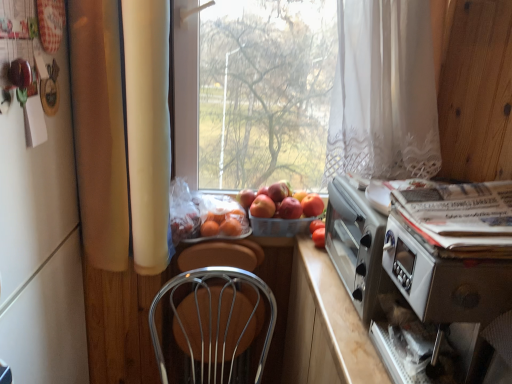
Describe the element at coordinates (262, 207) in the screenshot. Image resolution: width=512 pixels, height=384 pixels. I see `red matte apple at center, positioned as the 1th apple in left-to-right order` at that location.

What do you see at coordinates (278, 191) in the screenshot?
I see `red matte apple at center, the 3th apple viewed from the right` at bounding box center [278, 191].

At what (x,y) coordinates should I click in order to perform the action: click on red matte tomato at lower right, the first fruit in the right-to-left sequence. Please return your answer as a coordinate pair (x, y). Looking at the image, I should click on (319, 237).

What do you see at coordinates (222, 224) in the screenshot?
I see `orange matte at center, placed as the 2th fruit when sorted from right to left` at bounding box center [222, 224].

Find the location of a particular element. This screenshot has height=384, width=512. red matte apple at center, the 4th apple in the right-to-left sequence is located at coordinates (262, 207).

From a real-world perspective, which apple is the 3rd one above the plastic basket at center? Please provide its 2D coordinates.

[(312, 205)]

Is red matte apple at center, the fourth apple in the left-to-right sequence, spatially inside plastic basket at center, or outside of it?

red matte apple at center, the fourth apple in the left-to-right sequence, is outside plastic basket at center.

Considering the relative sizes of red matte apple at center, the fourth apple in the left-to-right sequence, and plastic basket at center in the image provided, is red matte apple at center, the fourth apple in the left-to-right sequence, taller than plastic basket at center?

No, red matte apple at center, the fourth apple in the left-to-right sequence, is not taller than plastic basket at center.

From the picture: Between red matte apple at center, the fourth apple in the left-to-right sequence, and plastic basket at center, which one has smaller width?

red matte apple at center, the fourth apple in the left-to-right sequence.

Which of these two, red matte apple at center, the fourth apple in the left-to-right sequence, or green leafy tree at center, is bigger?

green leafy tree at center is bigger.

Can you confirm if red matte apple at center, acting as the first apple starting from the right, is shorter than green leafy tree at center?

Yes.

Is point (311, 195) farther from viewer compared to point (269, 95)?

Yes, it is.

Is red matte apple at center, the fourth apple in the left-to-right sequence, touching green leafy tree at center?

No, red matte apple at center, the fourth apple in the left-to-right sequence, is not touching green leafy tree at center.

From a real-world perspective, is metallic wire chair at center beneath white glossy fridge at left?

Yes, from a real-world perspective, metallic wire chair at center is beneath white glossy fridge at left.

From the image's perspective, is metallic wire chair at center on top of white glossy fridge at left?

Incorrect, from the image's perspective, metallic wire chair at center is lower than white glossy fridge at left.

Which is farther, (191, 305) or (84, 373)?

The point (84, 373) is more distant.

Where is `chair on the right side of white glossy fridge at left`? This screenshot has height=384, width=512. chair on the right side of white glossy fridge at left is located at coordinates (211, 327).

Is metallic silver toaster at right not close to white lace curtain at upper center?

No.

Does metallic silver toaster at right have a greater width compared to white lace curtain at upper center?

Yes, metallic silver toaster at right is wider than white lace curtain at upper center.

Can you confirm if metallic silver toaster at right is taller than white lace curtain at upper center?

No.

Is white lace curtain at upper center bigger than red matte apple at center, the second apple when ordered from right to left?

Yes, white lace curtain at upper center is bigger than red matte apple at center, the second apple when ordered from right to left.

Is white lace curtain at upper center not within red matte apple at center, the second apple when ordered from right to left?

Indeed, white lace curtain at upper center is completely outside red matte apple at center, the second apple when ordered from right to left.

Can you tell me how much white lace curtain at upper center and red matte apple at center, the second apple when ordered from right to left, differ in facing direction?

The angular difference between white lace curtain at upper center and red matte apple at center, the second apple when ordered from right to left, is 9.63 degrees.

Is point (433, 131) closer to camera compared to point (297, 201)?

That is True.

What's the angular difference between green leafy tree at center and red matte apple at center, the 3th apple viewed from the right,'s facing directions?

They differ by 9.93 degrees in their facing directions.

Does green leafy tree at center turn towards red matte apple at center, the 2th apple viewed from the left?

Yes, green leafy tree at center is oriented towards red matte apple at center, the 2th apple viewed from the left.

Who is taller, green leafy tree at center or red matte apple at center, the 2th apple viewed from the left?

With more height is green leafy tree at center.

Are green leafy tree at center and red matte apple at center, the 2th apple viewed from the left, far apart?

No.

Is white glossy magazine at right beside red matte apple at center, the second apple when ordered from right to left?

No, white glossy magazine at right is not making contact with red matte apple at center, the second apple when ordered from right to left.

Where is `magazine that appears on the right of red matte apple at center, the second apple when ordered from right to left`? magazine that appears on the right of red matte apple at center, the second apple when ordered from right to left is located at coordinates (460, 216).

Does white glossy magazine at right have a greater width compared to red matte apple at center, arranged as the 3th apple when viewed from the left?

Yes.

From a real-world perspective, which is physically above, white glossy magazine at right or red matte apple at center, the second apple when ordered from right to left?

white glossy magazine at right, from a real-world perspective.

Where is `the 3rd apple positioned above the plastic basket at center (from the image's perspective)`? the 3rd apple positioned above the plastic basket at center (from the image's perspective) is located at coordinates click(312, 205).

The height and width of the screenshot is (384, 512). In order to click on tree in front of the red matte apple at center, acting as the first apple starting from the right in this screenshot , I will do `click(265, 91)`.

When comparing their distances from red matte apple at center, acting as the first apple starting from the right, does red matte tomato at lower right, the first fruit in the right-to-left sequence, or white glossy fridge at left seem further?

white glossy fridge at left.

Based on their spatial positions, is red matte apple at center, the fourth apple in the left-to-right sequence, or white glossy magazine at right further from red matte apple at center, positioned as the 1th apple in left-to-right order?

Based on the image, white glossy magazine at right appears to be further to red matte apple at center, positioned as the 1th apple in left-to-right order.

From the image, which object appears to be nearer to metallic silver toaster at right, metallic wire chair at center or white glossy fridge at left?

metallic wire chair at center is closer to metallic silver toaster at right.

Estimate the real-world distances between objects in this image. Which object is further from metallic wire chair at center, green leafy tree at center or red matte apple at center, the 3th apple viewed from the right?

green leafy tree at center is further to metallic wire chair at center.

Consider the image. Based on their spatial positions, is white glossy fridge at left or red matte tomato at lower right, the first fruit in the right-to-left sequence, further from white lace curtain at upper center?

Among the two, white glossy fridge at left is located further to white lace curtain at upper center.

Considering their positions, is red matte apple at center, the 2th apple viewed from the left, positioned closer to red matte tomato at lower right, the first fruit in the right-to-left sequence, than green leafy tree at center?

red matte apple at center, the 2th apple viewed from the left, is closer to red matte tomato at lower right, the first fruit in the right-to-left sequence.

Estimate the real-world distances between objects in this image. Which object is further from orange matte at center, placed as the 2th fruit when sorted from right to left, red matte apple at center, the second apple when ordered from right to left, or metallic wire chair at center?

metallic wire chair at center is further to orange matte at center, placed as the 2th fruit when sorted from right to left.

Considering their positions, is red matte apple at center, the second apple when ordered from right to left, positioned closer to red matte tomato at lower right, the first fruit in the right-to-left sequence, than green leafy tree at center?

Among the two, red matte apple at center, the second apple when ordered from right to left, is located nearer to red matte tomato at lower right, the first fruit in the right-to-left sequence.

The image size is (512, 384). What are the coordinates of `chair between white glossy magazine at right and red matte apple at center, acting as the first apple starting from the right, in the front-back direction` in the screenshot? It's located at (211, 327).

The width and height of the screenshot is (512, 384). What are the coordinates of `apple between red matte apple at center, the 3th apple viewed from the right, and red matte apple at center, the fourth apple in the left-to-right sequence, in the horizontal direction` in the screenshot? It's located at (290, 208).

Locate an element on the screen. This screenshot has width=512, height=384. tree located between white glossy magazine at right and red matte apple at center, the second apple when ordered from right to left, in the depth direction is located at coordinates (265, 91).

Locate an element on the screen. This screenshot has height=384, width=512. magazine between white lace curtain at upper center and metallic silver toaster at right vertically is located at coordinates [460, 216].